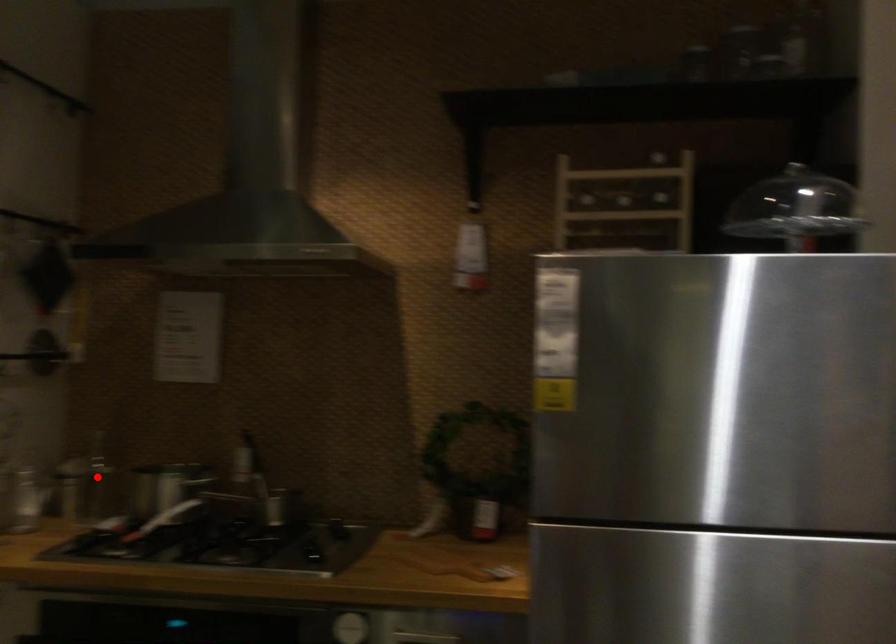
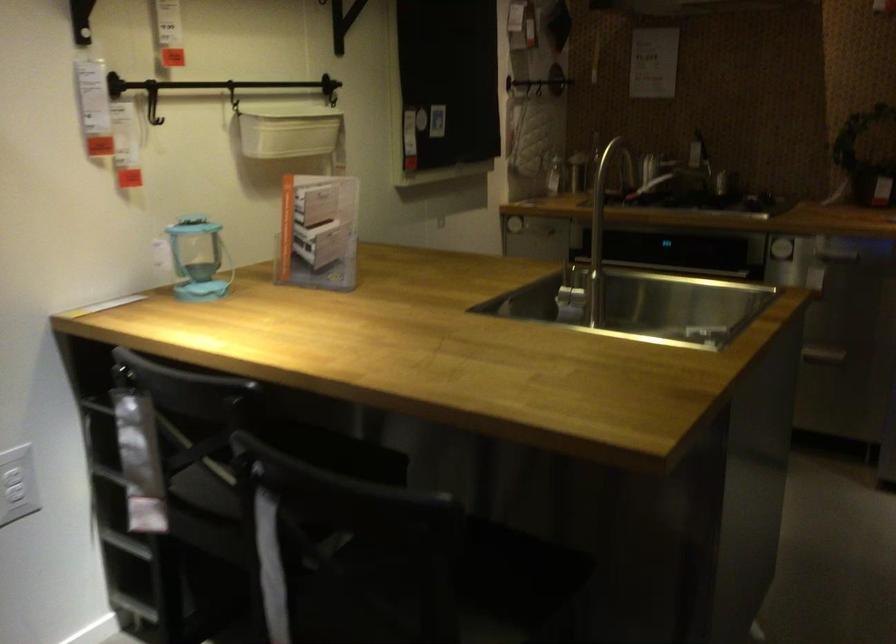
Question: I am providing you with two images of the same scene from different viewpoints. A red point is marked on the first image. At the location where the point appears in image 1, is it still visible in image 2?

Choices:
 (A) Yes
 (B) No

Answer: (B)